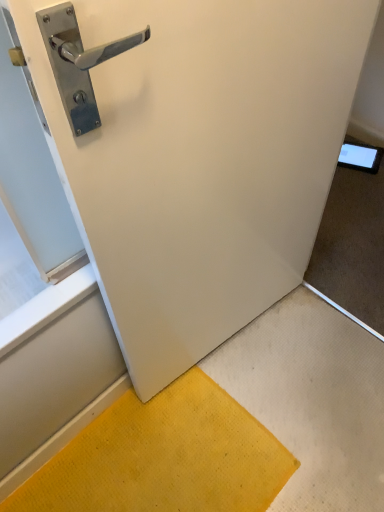
Looking at this image, what is the approximate height of yellow textured mat at lower left?

yellow textured mat at lower left is 4.28 centimeters tall.

Find the location of a particular element. Image resolution: width=384 pixels, height=512 pixels. yellow textured mat at lower left is located at coordinates (164, 457).

Measure the distance between point (67, 461) and camera.

The depth of point (67, 461) is 1.19 meters.

Image resolution: width=384 pixels, height=512 pixels. What do you see at coordinates (164, 457) in the screenshot?
I see `yellow textured mat at lower left` at bounding box center [164, 457].

Where is `yellow textured mat at lower left`? The width and height of the screenshot is (384, 512). yellow textured mat at lower left is located at coordinates (164, 457).